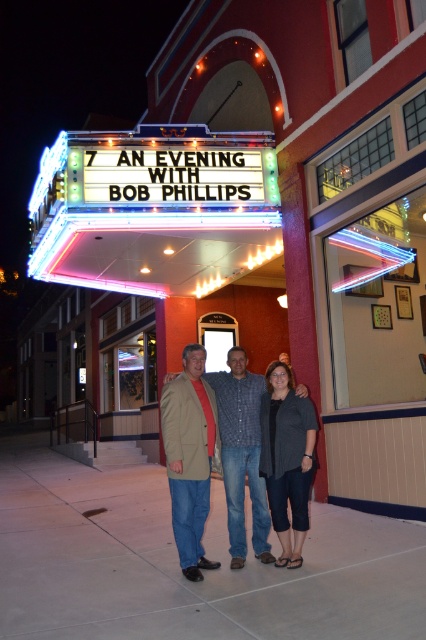
Question: Can you confirm if neontexturedmarquee sign at upper center is wider than matte black jacket at center?

Choices:
 (A) yes
 (B) no

Answer: (B)

Question: Which of the following is the closest to the observer?

Choices:
 (A) (253, 403)
 (B) (69, 278)
 (C) (189, 561)

Answer: (C)

Question: Observing the image, what is the correct spatial positioning of beige fabric jacket at center in reference to dark gray textured blazer at center?

Choices:
 (A) below
 (B) above

Answer: (B)

Question: Which point is closer to the camera?

Choices:
 (A) (216, 256)
 (B) (253, 449)
 (C) (206, 461)
 (D) (279, 422)

Answer: (D)

Question: Does neontexturedmarquee sign at upper center have a smaller size compared to beige fabric jacket at center?

Choices:
 (A) no
 (B) yes

Answer: (B)

Question: Which point is closer to the camera?

Choices:
 (A) (184, 556)
 (B) (134, 214)
 (C) (227, 381)
 (D) (282, 484)

Answer: (A)